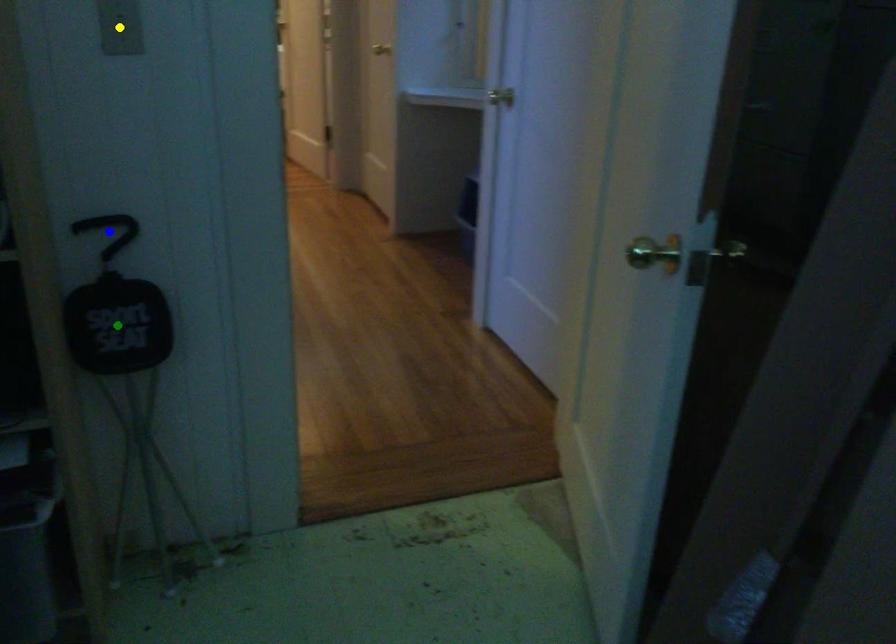
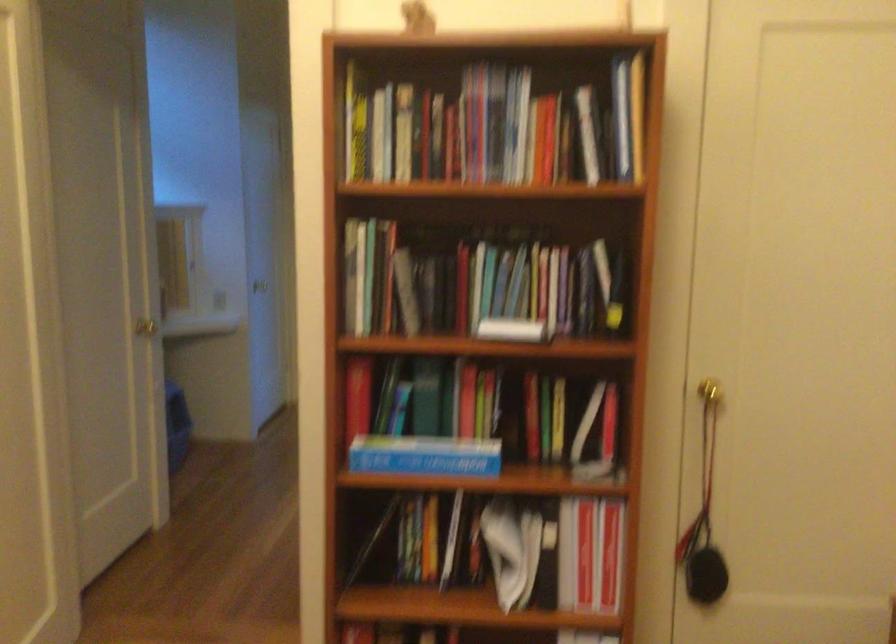
I am providing you with two images of the same scene from different viewpoints. Three points are marked in image1. Which point corresponds to a part or object that is occluded in image2?In image1, three points are marked. Which of them correspond to a part or object that is occluded in image2?Among the three points shown in image1, which one corresponds to a part or object that is no longer visible due to occlusion in image2?

yellow point, blue point, green point